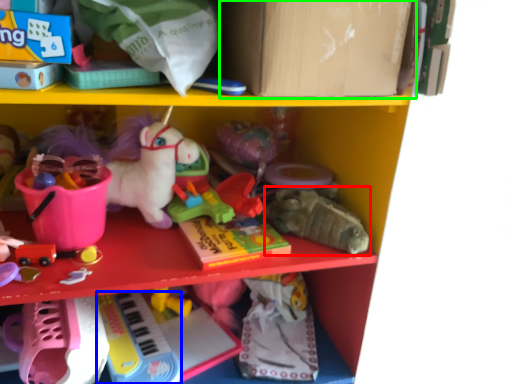
Question: Which object is positioned farthest from toy (highlighted by a red box)? Select from toy (highlighted by a blue box) and cardboard box (highlighted by a green box).

Choices:
 (A) toy
 (B) cardboard box

Answer: (A)